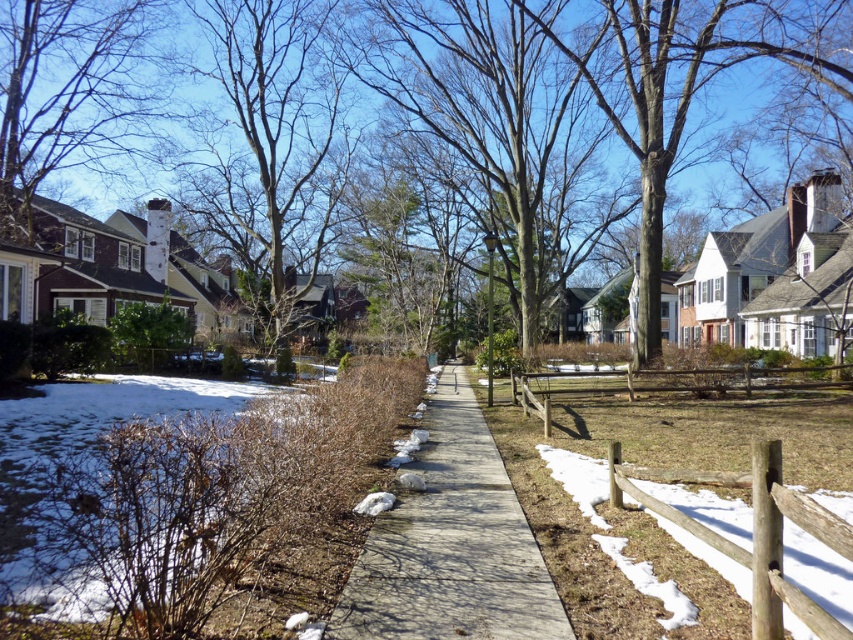
Looking at this image, you are a delivery person trying to navigate a suburban street. You see the concrete at center and the smooth gray chimney at upper left. Which object is located to the right of the other?

The concrete at center is positioned on the right side of the smooth gray chimney at upper left, so the concrete at center is to the right of the smooth gray chimney at upper left.

You are a drone operator who needs to fly a drone from the smooth gray chimney at upper left to the brown wooden fence at lower right. Given that the drone has a maximum flight range of 40 meters, will it be able to reach the fence without needing to recharge?

The smooth gray chimney at upper left and brown wooden fence at lower right are 39.29 meters apart. Since the drone can fly up to 40 meters, it will be able to reach the brown wooden fence at lower right without needing to recharge.